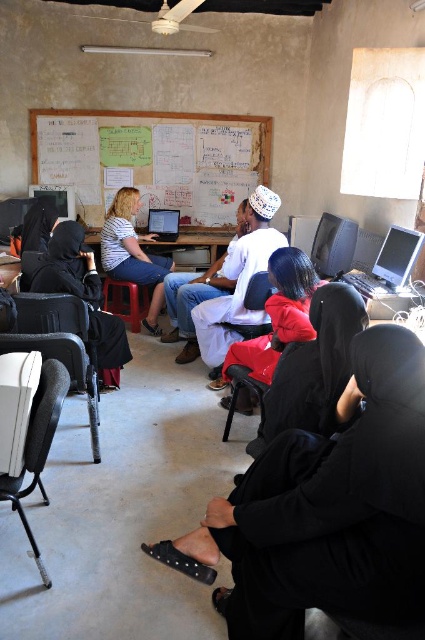
Question: Considering the real-world distances, which object is farthest from the black plastic chair at center?

Choices:
 (A) white cotton shirt at center
 (B) white paperboard at upper center
 (C) black plastic chair at lower left

Answer: (B)

Question: Which of the following is the farthest from the observer?

Choices:
 (A) matte black laptop at center
 (B) white paperboard at upper center
 (C) striped cotton shirt at center
 (D) black matte hijab at left

Answer: (A)

Question: Considering the relative positions of black plastic chair at lower left and black plastic chair at center in the image provided, where is black plastic chair at lower left located with respect to black plastic chair at center?

Choices:
 (A) left
 (B) right

Answer: (A)

Question: Which object appears farthest from the camera in this image?

Choices:
 (A) striped cotton shirt at center
 (B) white paperboard at upper center
 (C) white cotton shirt at center
 (D) matte plastic chair at center

Answer: (B)

Question: Does black fabric chair at lower left have a smaller size compared to black plastic chair at center?

Choices:
 (A) no
 (B) yes

Answer: (B)

Question: Does striped cotton shirt at center lie in front of black plastic chair at lower left?

Choices:
 (A) yes
 (B) no

Answer: (B)